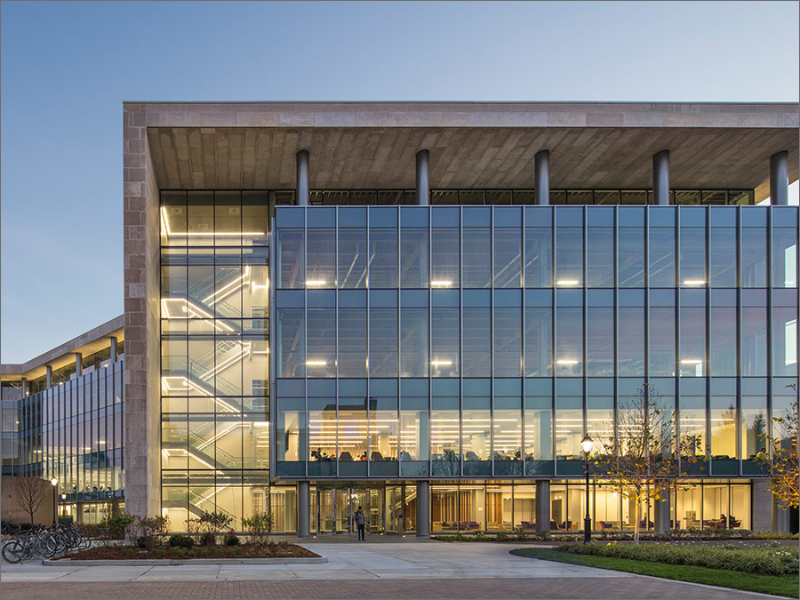
You are a GUI agent. You are given a task and a screenshot of the screen. Output one action in this format:
    pyautogui.click(x=<x>, y=<y>)
    Task: Click on the stairwell
    
    Given the screenshot: What is the action you would take?
    pyautogui.click(x=228, y=285)